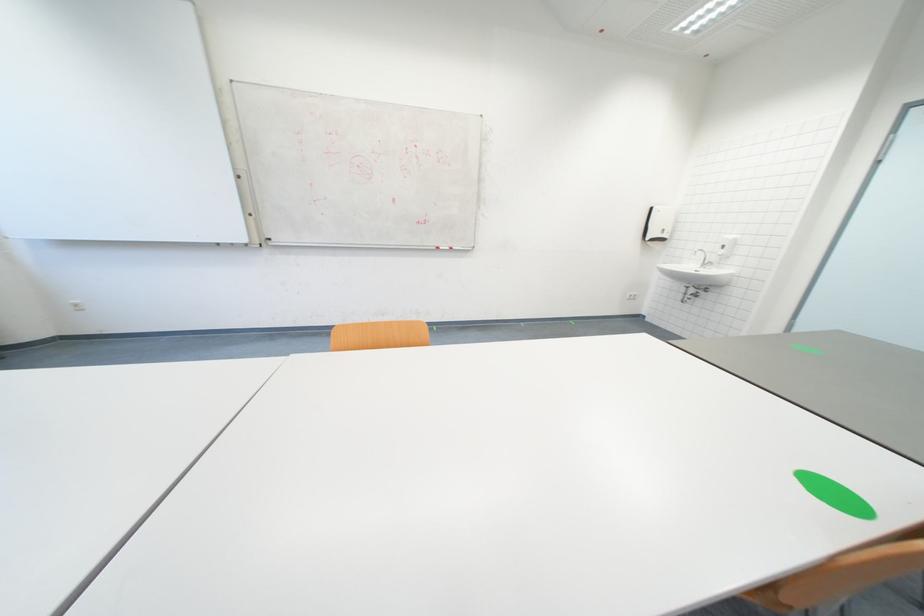
I want to click on faucet lever handle, so click(700, 256).